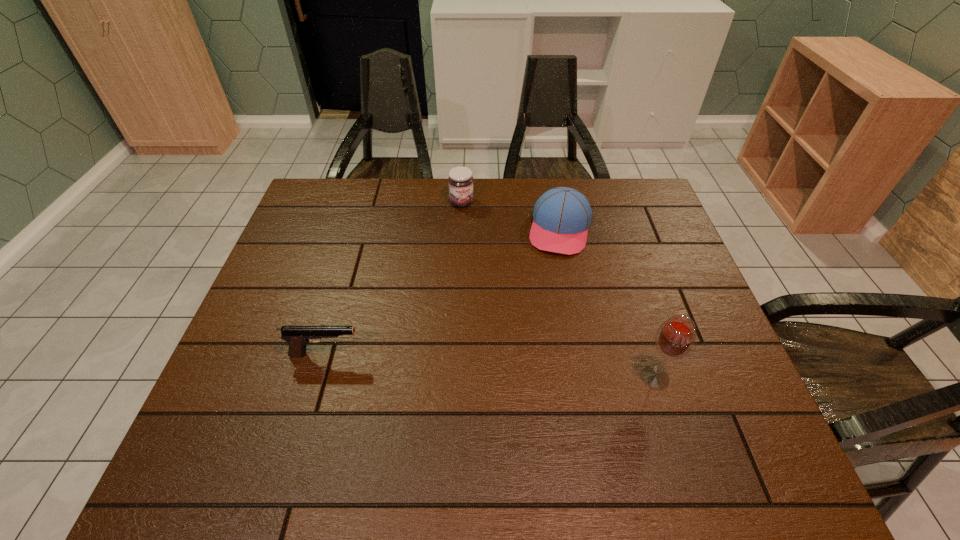
The width and height of the screenshot is (960, 540). Identify the location of the leftmost object. (297, 337).

Image resolution: width=960 pixels, height=540 pixels. I want to click on pistol, so click(297, 337).

You are a GUI agent. You are given a task and a screenshot of the screen. Output one action in this format:
    pyautogui.click(x=<x>, y=<y>)
    Task: Click on the tallest object
    The width and height of the screenshot is (960, 540).
    Given the screenshot: What is the action you would take?
    pyautogui.click(x=675, y=337)

Locate an element on the screen. the nearest object is located at coordinates click(x=675, y=337).

Locate an element on the screen. The image size is (960, 540). the second object from right to left is located at coordinates (562, 215).

You are a GUI agent. You are given a task and a screenshot of the screen. Output one action in this format:
    pyautogui.click(x=<x>, y=<y>)
    Task: Click on the second object from left to right
    
    Given the screenshot: What is the action you would take?
    pyautogui.click(x=460, y=181)

Where is `vacant space located at the muzzle of the pistol`? The width and height of the screenshot is (960, 540). vacant space located at the muzzle of the pistol is located at coordinates (465, 354).

Locate an element on the screen. free point located on the left of the tallest object is located at coordinates (532, 377).

The width and height of the screenshot is (960, 540). Identify the location of free space located on the front-facing side of the third object from left to right. (548, 297).

Image resolution: width=960 pixels, height=540 pixels. Identify the location of free space located 0.370m on the front-facing side of the third object from left to right. (535, 364).